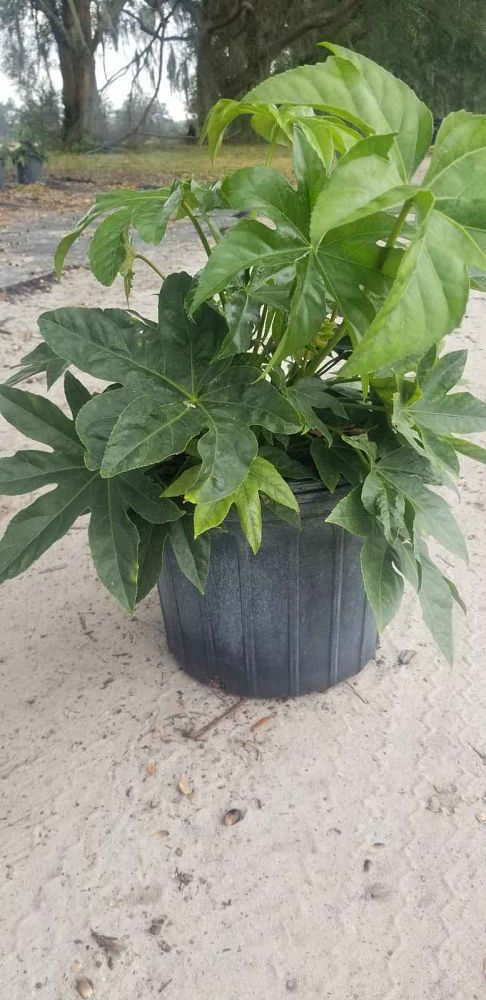
The height and width of the screenshot is (1000, 486). I want to click on pot, so click(x=282, y=596), click(x=27, y=171).